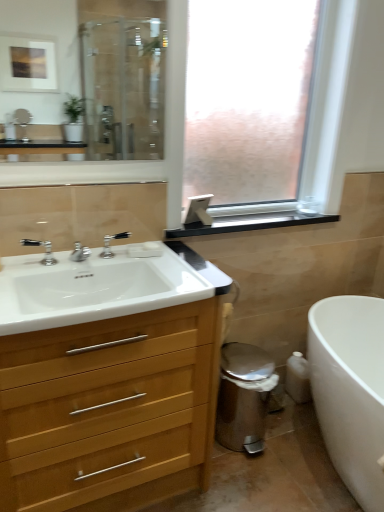
The height and width of the screenshot is (512, 384). I want to click on free space above black matte window sill at upper center (from a real-world perspective), so click(261, 215).